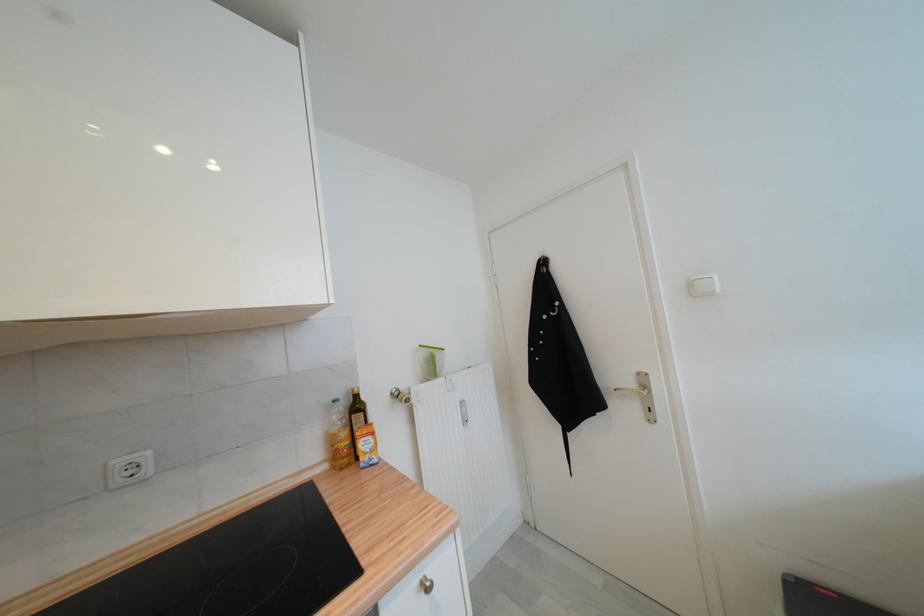
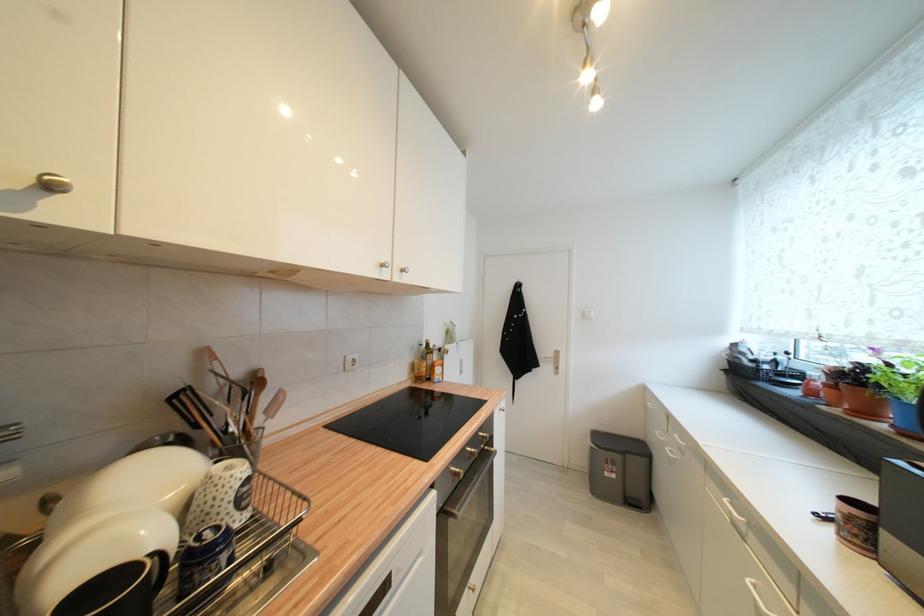
In a continuous first-person perspective shot, in which direction is the camera moving?

The movement direction of the cameraman is left, backward.